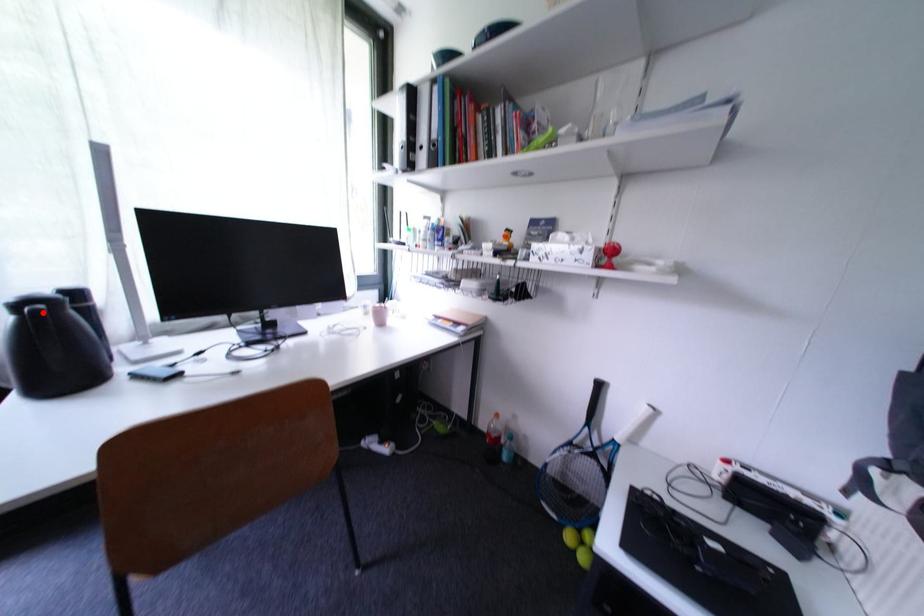
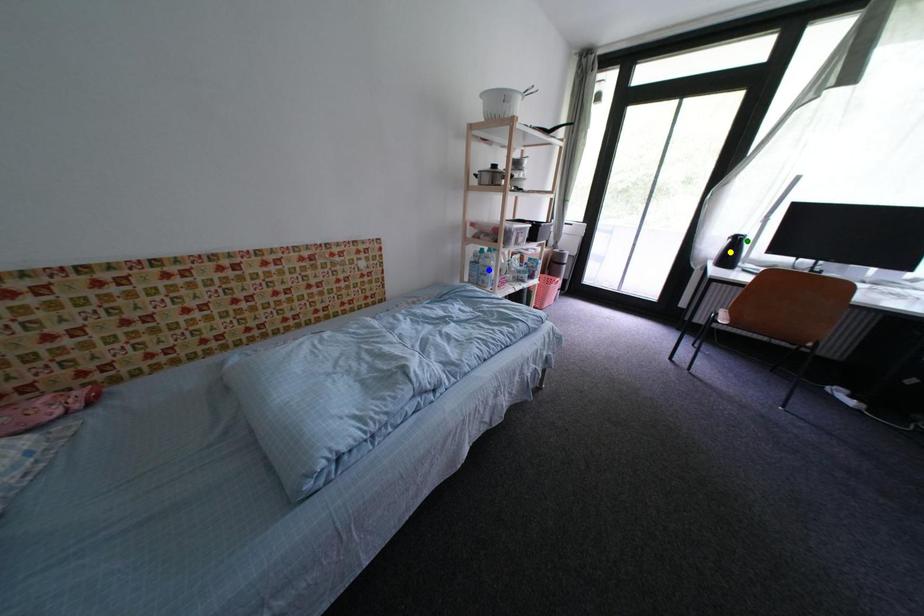
Question: I am providing you with two images of the same scene from different viewpoints. A red point is marked on the first image. You are given multiple points on the second image. Which spot in image 2 lines up with the point in image 1?

Choices:
 (A) yellow point
 (B) green point
 (C) blue point

Answer: (B)